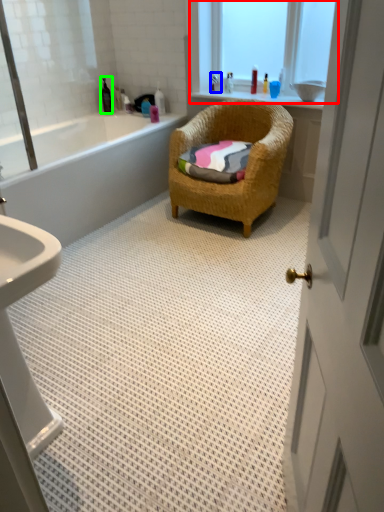
Question: Considering the real-world distances, which object is farthest from window (highlighted by a red box)? toiletry (highlighted by a blue box) or toiletry (highlighted by a green box)?

Choices:
 (A) toiletry
 (B) toiletry

Answer: (B)